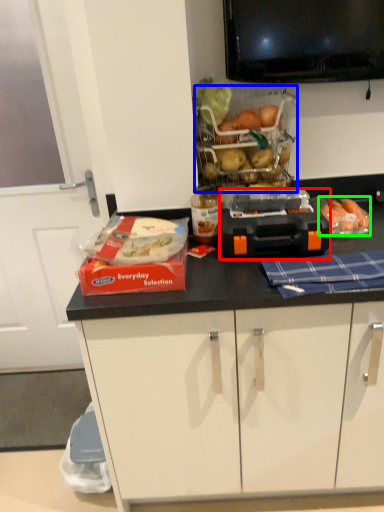
Question: Based on their relative distances, which object is farther from appliance (highlighted by a red box)? Choose from basket (highlighted by a blue box) and food (highlighted by a green box).

Choices:
 (A) basket
 (B) food

Answer: (A)